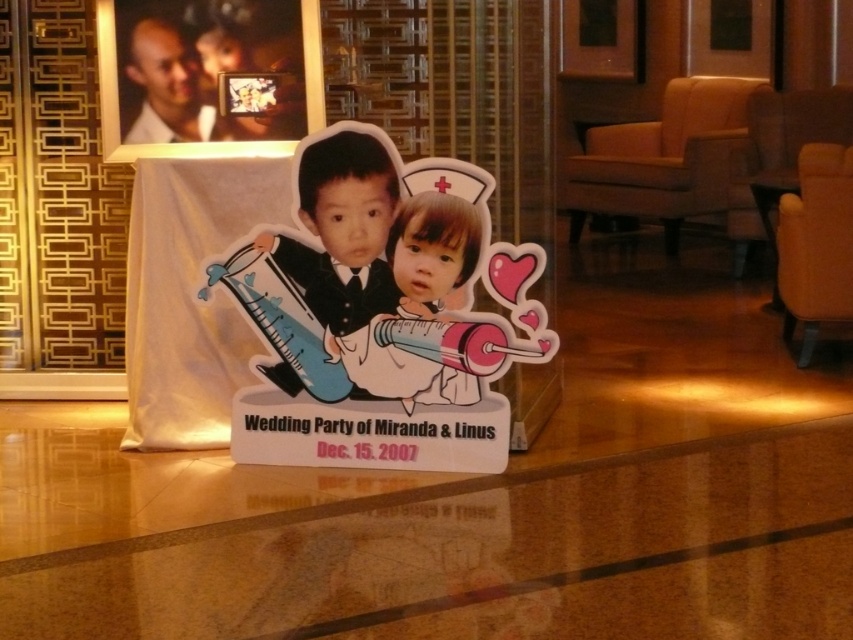
Question: Is the position of matte black suit at center more distant than that of matte white child at center?

Choices:
 (A) yes
 (B) no

Answer: (B)

Question: Which point is closer to the camera?

Choices:
 (A) (338, 312)
 (B) (358, 342)

Answer: (A)

Question: Which of the following is the closest to the observer?

Choices:
 (A) click(x=312, y=170)
 (B) click(x=474, y=401)

Answer: (A)

Question: Observing the image, what is the correct spatial positioning of matte black suit at center in reference to matte white child at center?

Choices:
 (A) right
 (B) left

Answer: (B)

Question: Which object is closer to the camera taking this photo?

Choices:
 (A) matte white child at center
 (B) matte black suit at center

Answer: (B)

Question: Is matte black suit at center in front of matte white child at center?

Choices:
 (A) yes
 (B) no

Answer: (A)